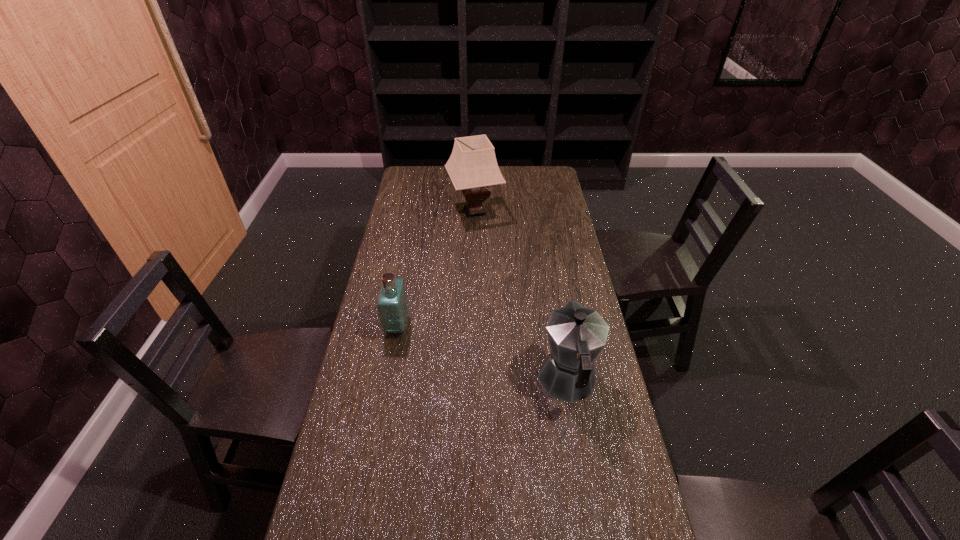
This screenshot has height=540, width=960. I want to click on the closest object to the rightmost object, so click(x=392, y=307).

I want to click on free space that satisfies the following two spatial constraints: 1. on the front label of the shortest object; 2. at the spout of the rightmost object, so click(387, 382).

Where is `free space that satisfies the following two spatial constraints: 1. at the spout of the coffeepot; 2. on the front label of the shortest object`? free space that satisfies the following two spatial constraints: 1. at the spout of the coffeepot; 2. on the front label of the shortest object is located at coordinates (558, 326).

Identify the location of vacant position in the image that satisfies the following two spatial constraints: 1. on the front label of the leftmost object; 2. at the spout of the rightmost object. The height and width of the screenshot is (540, 960). (387, 382).

At what (x,y) coordinates should I click in order to perform the action: click on free space that satisfies the following two spatial constraints: 1. on the front label of the perfume; 2. at the spout of the nearest object. Please return your answer as a coordinate pair (x, y). Looking at the image, I should click on (387, 382).